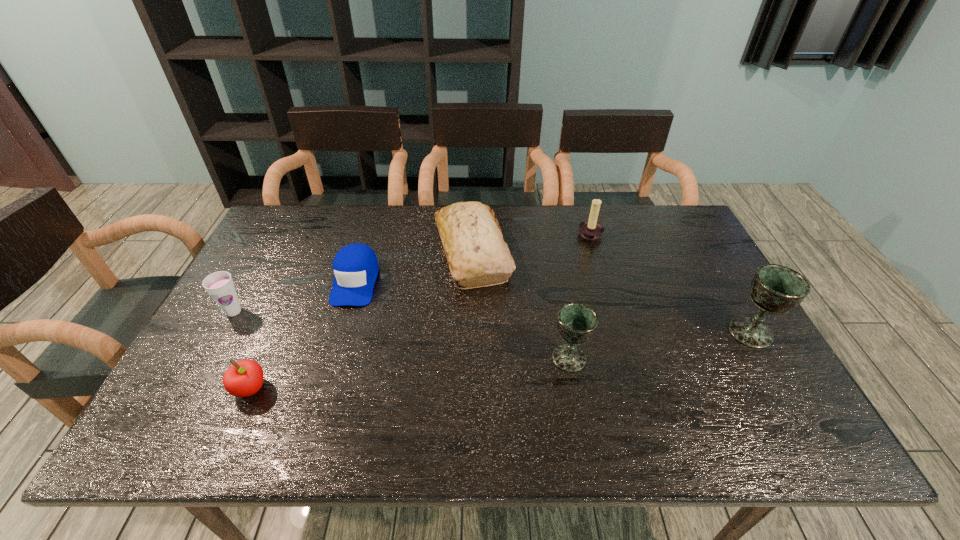
The image size is (960, 540). In order to click on the left chalice in this screenshot , I will do `click(577, 322)`.

You are a GUI agent. You are given a task and a screenshot of the screen. Output one action in this format:
    pyautogui.click(x=<x>, y=<y>)
    Task: Click on the shorter chalice
    
    Given the screenshot: What is the action you would take?
    point(577,322)

Locate an element on the screen. This screenshot has height=540, width=960. the right chalice is located at coordinates (775, 289).

Locate an element on the screen. This screenshot has height=540, width=960. the rightmost object is located at coordinates (775, 289).

Locate an element on the screen. candle holder is located at coordinates (590, 229).

The image size is (960, 540). I want to click on cup, so 220,286.

The image size is (960, 540). Identify the location of bread. (477, 255).

Where is `baseball cap`? Image resolution: width=960 pixels, height=540 pixels. baseball cap is located at coordinates (355, 266).

The image size is (960, 540). Find the location of `the sixth object from right to left`. the sixth object from right to left is located at coordinates (244, 378).

Where is `vacant space situated on the back of the fifth object from left to right`? vacant space situated on the back of the fifth object from left to right is located at coordinates (555, 276).